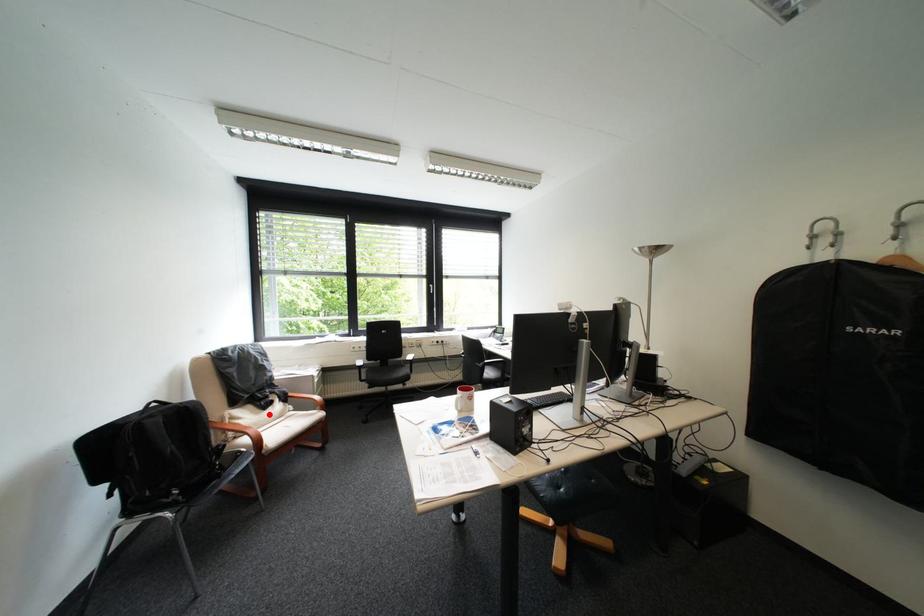
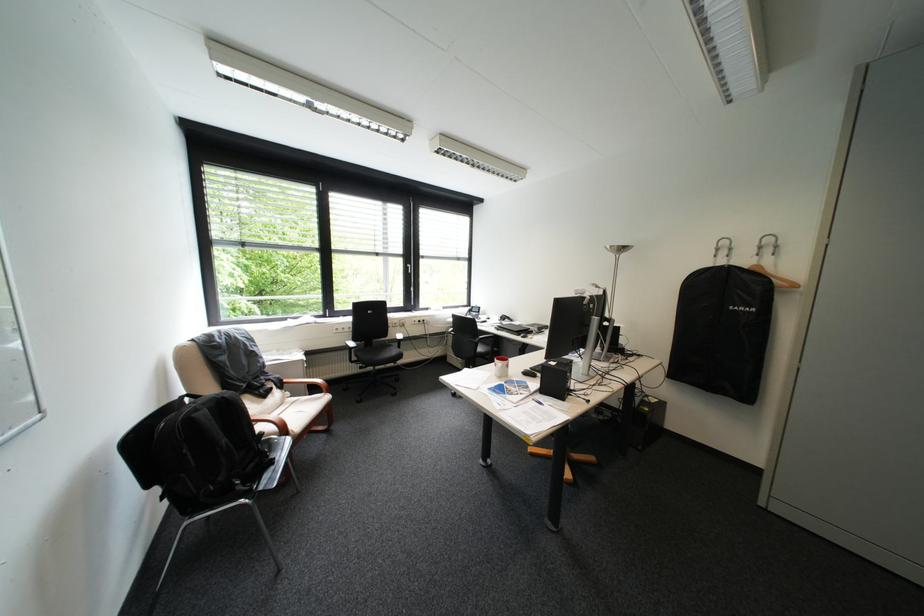
Question: I am providing you with two images of the same scene from different viewpoints. Given a red point in image1, look at the same physical point in image2. Is it:

Choices:
 (A) Closer to the viewpoint
 (B) Farther from the viewpoint

Answer: (A)